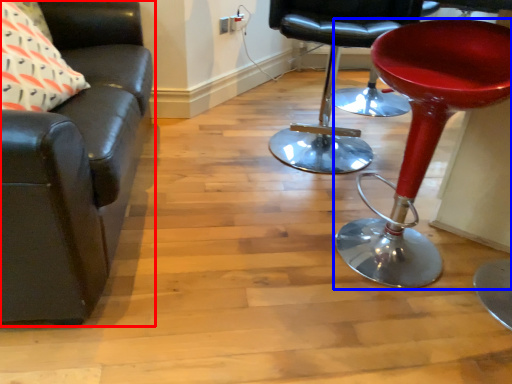
Question: Which object appears farthest to the camera in this image, chair (highlighted by a red box) or stool (highlighted by a blue box)?

Choices:
 (A) chair
 (B) stool

Answer: (B)